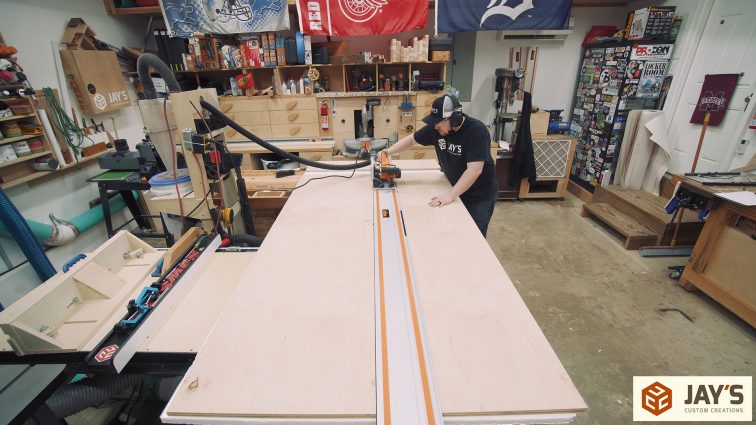
The image size is (756, 425). I want to click on concrete floor, so click(x=559, y=324).